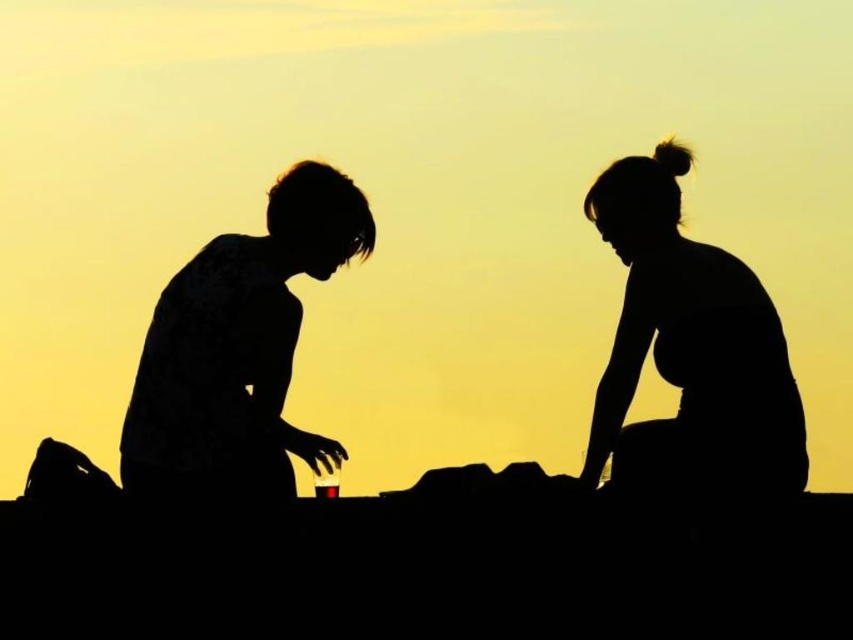
You are trying to locate the silhouette figures at center in the image. According to the coordinates provided, where exactly are they positioned?

The silhouette figures at center are positioned at coordinates point (688, 355).

You are a photographer trying to capture the scene with the silhouette figures at center and the silhouette hair at upper right. Based on their positions, which object is located to the right side of the other?

The silhouette figures at center are to the right of the silhouette hair at upper right.

You are a photographer trying to capture the two figures in the scene. Which object, the silhouette hair at upper right or the silhouette shirt at left, will appear larger in your photo?

The silhouette hair at upper right will appear larger in the photo because it is closer to the viewer than the silhouette shirt at left.